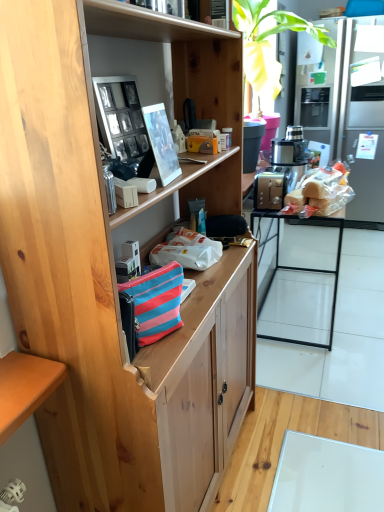
Question: From a real-world perspective, is matte plastic picture frame at upper center, acting as the second picture frame starting from the left, physically located above or below wooden cabinet at center?

Choices:
 (A) above
 (B) below

Answer: (A)

Question: From the image's perspective, is matte plastic picture frame at upper center, acting as the second picture frame starting from the left, above or below wooden cabinet at center?

Choices:
 (A) below
 (B) above

Answer: (B)

Question: Which is nearer to the silver metallic refrigerator at right?

Choices:
 (A) translucent plastic bread at right
 (B) matte plastic picture frame at upper center, acting as the second picture frame starting from the left
 (C) white glossy table at center
 (D) metallic silver food processor at center-right
 (E) metallic gold toaster at right

Answer: (C)

Question: Estimate the real-world distances between objects in this image. Which object is farther from the striped fabric handbag at center?

Choices:
 (A) metallic gold toaster at right
 (B) white glossy table at center
 (C) matte plastic picture frame at upper center, arranged as the 1th picture frame when viewed from the right
 (D) silver metallic refrigerator at right
 (E) metallic silver food processor at center-right

Answer: (D)